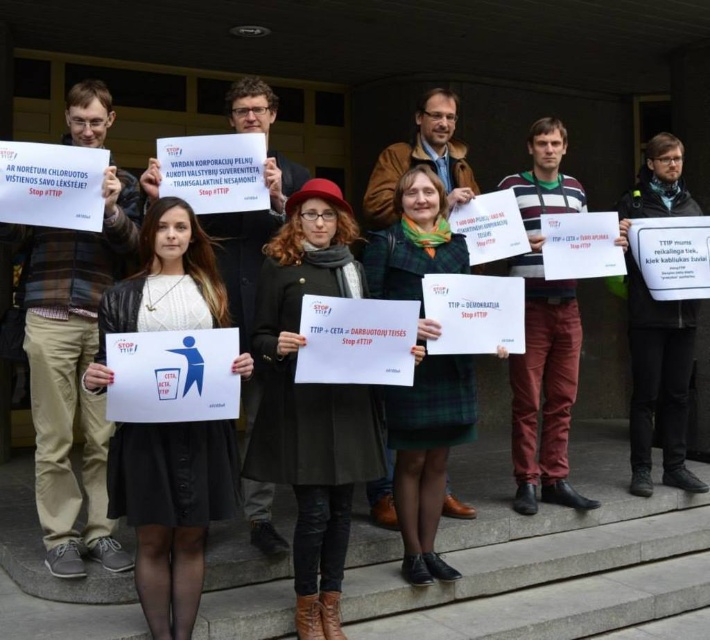
Question: Can you confirm if striped sweater at center is thinner than green woolen sweater at center?

Choices:
 (A) no
 (B) yes

Answer: (B)

Question: Can you confirm if white matte sign at center is positioned above green woolen sweater at center?

Choices:
 (A) yes
 (B) no

Answer: (B)

Question: Does white matte sign at center have a lesser width compared to plaid shirt at left?

Choices:
 (A) no
 (B) yes

Answer: (B)

Question: Which point appears farthest from the camera in this image?

Choices:
 (A) (674, 344)
 (B) (43, 488)
 (C) (376, 220)

Answer: (A)

Question: Which object is closer to the camera taking this photo?

Choices:
 (A) plaid shirt at left
 (B) striped sweater at center
 (C) green woolen sweater at center

Answer: (A)

Question: Among these points, which one is nearest to the camera?

Choices:
 (A) (170, 564)
 (B) (547, 317)
 (C) (633, 216)

Answer: (A)